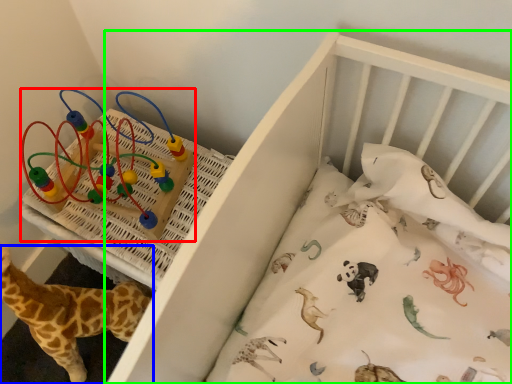
Question: Which object is positioned closest to toy (highlighted by a red box)? Select from giraffe (highlighted by a blue box) and infant bed (highlighted by a green box).

Choices:
 (A) giraffe
 (B) infant bed

Answer: (A)